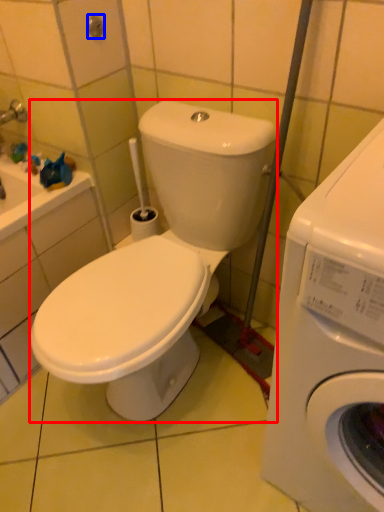
Question: Which of the following is the closest to the observer, washing machine (highlighted by a red box) or shower (highlighted by a blue box)?

Choices:
 (A) washing machine
 (B) shower

Answer: (A)